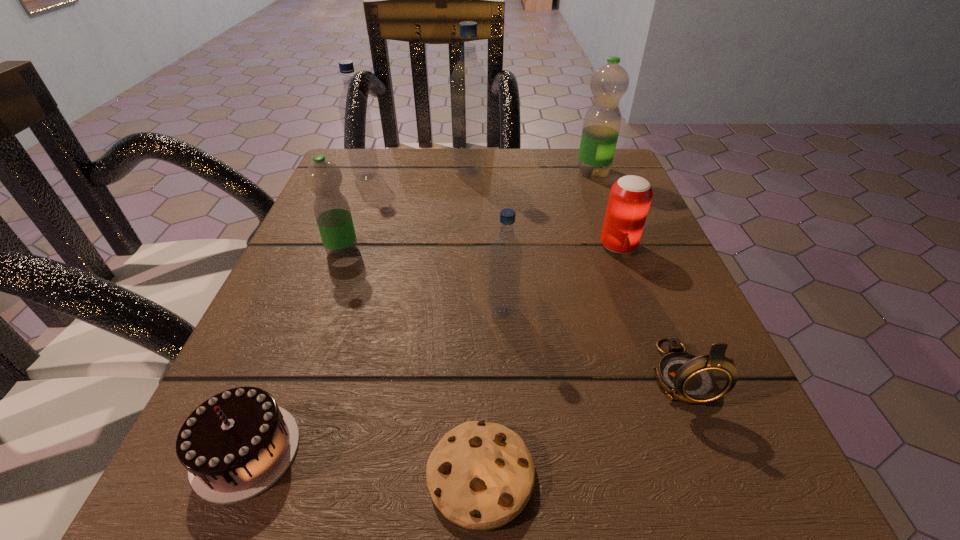
At what (x,y) coordinates should I click in order to perform the action: click on object at the near left corner. Please return your answer as a coordinate pair (x, y). The height and width of the screenshot is (540, 960). Looking at the image, I should click on (238, 443).

I want to click on object located in the far right corner section of the desktop, so click(608, 84).

In the image, there is a desktop. Find the location of `vacant space at the far edge`. vacant space at the far edge is located at coordinates (488, 183).

In the image, there is a desktop. Identify the location of vacant space at the near edge. (530, 502).

Locate an element on the screen. The width and height of the screenshot is (960, 540). vacant space at the left edge is located at coordinates (354, 359).

The image size is (960, 540). In order to click on blank space at the right edge of the desktop in this screenshot , I will do `click(669, 303)`.

Find the location of a particular element. The width and height of the screenshot is (960, 540). vacant space at the near left corner is located at coordinates (299, 520).

The image size is (960, 540). What are the coordinates of `vacant space at the far right corner of the desktop` in the screenshot? It's located at (559, 152).

Locate an element on the screen. This screenshot has width=960, height=540. empty space between the nearest water bottle and the red beer can is located at coordinates (561, 279).

At what (x,y) coordinates should I click in order to perform the action: click on free space between the fourth nearest object and the red beer can. Please return your answer as a coordinate pair (x, y). Looking at the image, I should click on (561, 279).